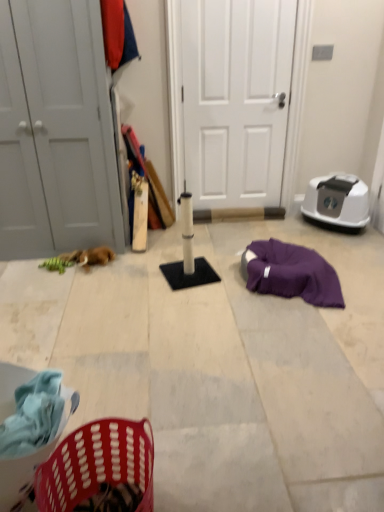
Question: Is brown plush toy at left closer to camera compared to plastic laundry basket at lower left?

Choices:
 (A) no
 (B) yes

Answer: (A)

Question: From a real-world perspective, is brown plush toy at left positioned under plastic laundry basket at lower left based on gravity?

Choices:
 (A) no
 (B) yes

Answer: (B)

Question: From the image's perspective, is brown plush toy at left under plastic laundry basket at lower left?

Choices:
 (A) yes
 (B) no

Answer: (B)

Question: Can you confirm if brown plush toy at left is shorter than plastic laundry basket at lower left?

Choices:
 (A) no
 (B) yes

Answer: (B)

Question: Can we say brown plush toy at left lies outside plastic laundry basket at lower left?

Choices:
 (A) yes
 (B) no

Answer: (A)

Question: From a real-world perspective, is white matte scratching post at center physically located above or below brown plush toy at left?

Choices:
 (A) above
 (B) below

Answer: (B)

Question: In terms of width, does white matte scratching post at center look wider or thinner when compared to brown plush toy at left?

Choices:
 (A) wide
 (B) thin

Answer: (A)

Question: From the image's perspective, is white matte scratching post at center above or below brown plush toy at left?

Choices:
 (A) below
 (B) above

Answer: (A)

Question: Would you say white matte scratching post at center is inside or outside brown plush toy at left?

Choices:
 (A) inside
 (B) outside

Answer: (B)

Question: From a real-world perspective, is white matte scratching post at center physically located above or below white matte door at left, which appears as the 2th door when viewed from the right?

Choices:
 (A) below
 (B) above

Answer: (A)

Question: Relative to white matte door at left, the 1th door positioned from the left, is white matte scratching post at center in front or behind?

Choices:
 (A) front
 (B) behind

Answer: (A)

Question: Looking at the image, does white matte scratching post at center seem bigger or smaller compared to white matte door at left, the 1th door positioned from the left?

Choices:
 (A) small
 (B) big

Answer: (A)

Question: Is white matte scratching post at center taller or shorter than white matte door at left, the 1th door positioned from the left?

Choices:
 (A) tall
 (B) short

Answer: (B)

Question: Is plastic laundry basket at lower left in front of or behind white matte door at left, which appears as the 2th door when viewed from the right, in the image?

Choices:
 (A) front
 (B) behind

Answer: (A)

Question: From a real-world perspective, is plastic laundry basket at lower left physically located above or below white matte door at left, the 1th door positioned from the left?

Choices:
 (A) below
 (B) above

Answer: (A)